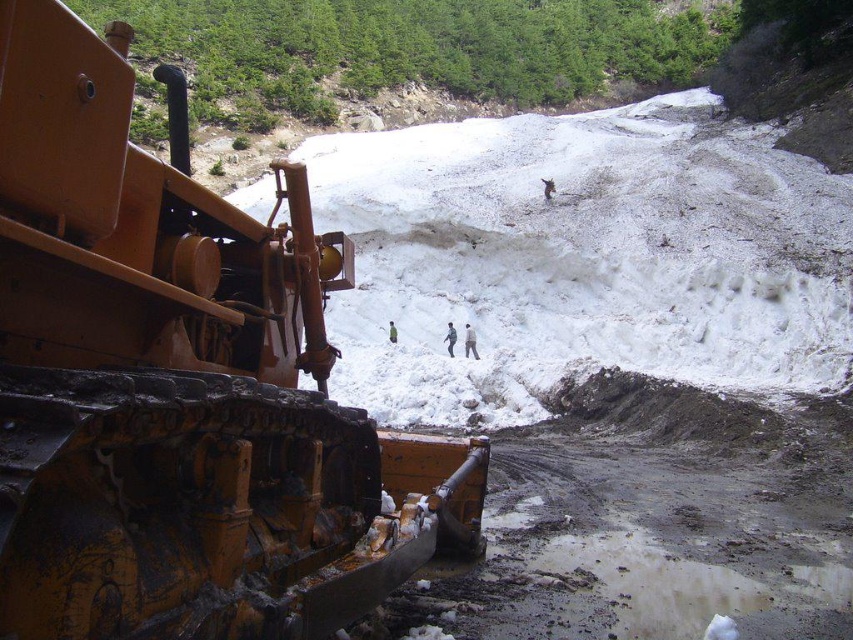
Can you confirm if matte yellow tractor at left is wider than green fabric jacket at center?

In fact, matte yellow tractor at left might be narrower than green fabric jacket at center.

Who is taller, matte yellow tractor at left or green fabric jacket at center?

Standing taller between the two is green fabric jacket at center.

Between point (27, 400) and point (393, 330), which one is positioned in front?

Positioned in front is point (27, 400).

At what (x,y) coordinates should I click in order to perform the action: click on matte yellow tractor at left. Please return your answer as a coordinate pair (x, y). This screenshot has height=640, width=853. Looking at the image, I should click on (180, 384).

Who is more distant from viewer, (x=454, y=330) or (x=395, y=342)?

The point (x=395, y=342) is behind.

Can you confirm if dark gray fabric jacket at center is positioned below green fabric jacket at center?

Yes, dark gray fabric jacket at center is below green fabric jacket at center.

This screenshot has height=640, width=853. I want to click on dark gray fabric jacket at center, so coord(450,339).

Who is shorter, light brown fabric jacket at center or green fabric jacket at center?

Standing shorter between the two is green fabric jacket at center.

Based on the photo, does light brown fabric jacket at center have a smaller size compared to green fabric jacket at center?

Incorrect, light brown fabric jacket at center is not smaller in size than green fabric jacket at center.

Where is `light brown fabric jacket at center`? The width and height of the screenshot is (853, 640). light brown fabric jacket at center is located at coordinates (469, 340).